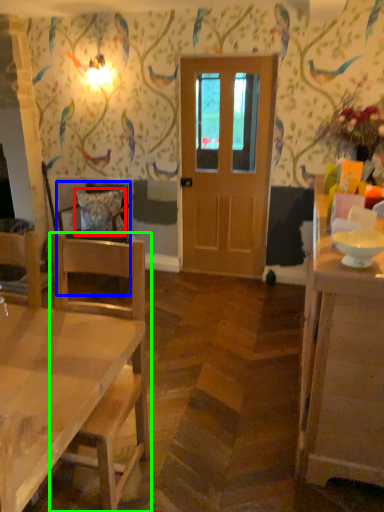
Question: Which is nearer to the pillow (highlighted by a red box)? chair (highlighted by a blue box) or chair (highlighted by a green box).

Choices:
 (A) chair
 (B) chair

Answer: (A)